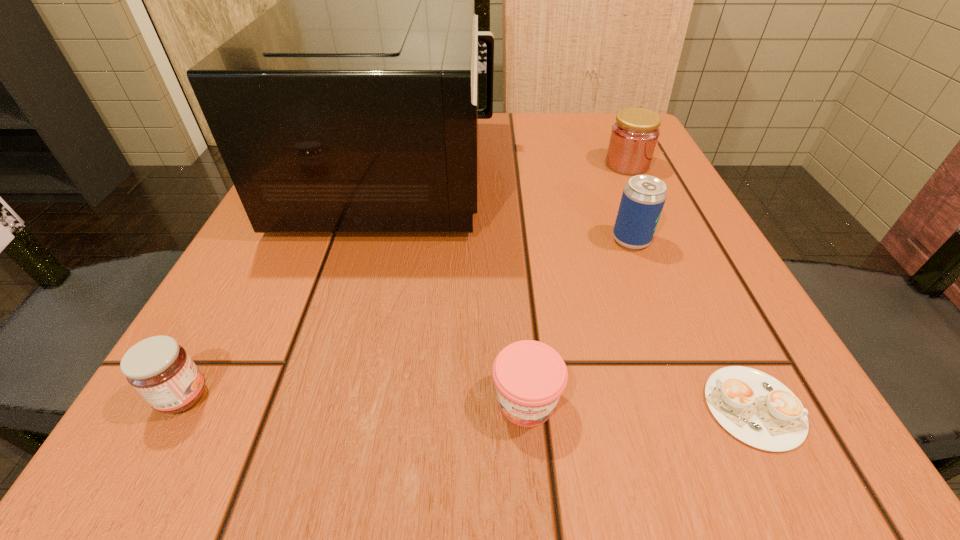
This screenshot has width=960, height=540. Identify the location of jam that is at the right edge. (634, 136).

What are the coordinates of `cappuccino that is at the right edge` in the screenshot? It's located at (756, 408).

At what (x,y) coordinates should I click in order to perform the action: click on object present at the far left corner. Please return your answer as a coordinate pair (x, y). Image resolution: width=960 pixels, height=540 pixels. Looking at the image, I should click on 350,106.

In order to click on object at the near left corner in this screenshot , I will do `click(158, 368)`.

Identify the location of object at the far right corner. (634, 136).

The height and width of the screenshot is (540, 960). Find the location of `object at the near right corner`. object at the near right corner is located at coordinates (756, 408).

At what (x,y) coordinates should I click in order to perform the action: click on vacant area at the far edge of the desktop. Please return your answer as a coordinate pair (x, y). Looking at the image, I should click on (x=498, y=156).

Identify the location of free spot at the near edge of the desktop. pyautogui.click(x=395, y=406).

Image resolution: width=960 pixels, height=540 pixels. In order to click on blank space at the left edge of the desktop in this screenshot , I will do `click(193, 353)`.

In the image, there is a desktop. Where is `free region at the right edge`? The image size is (960, 540). free region at the right edge is located at coordinates pos(669,167).